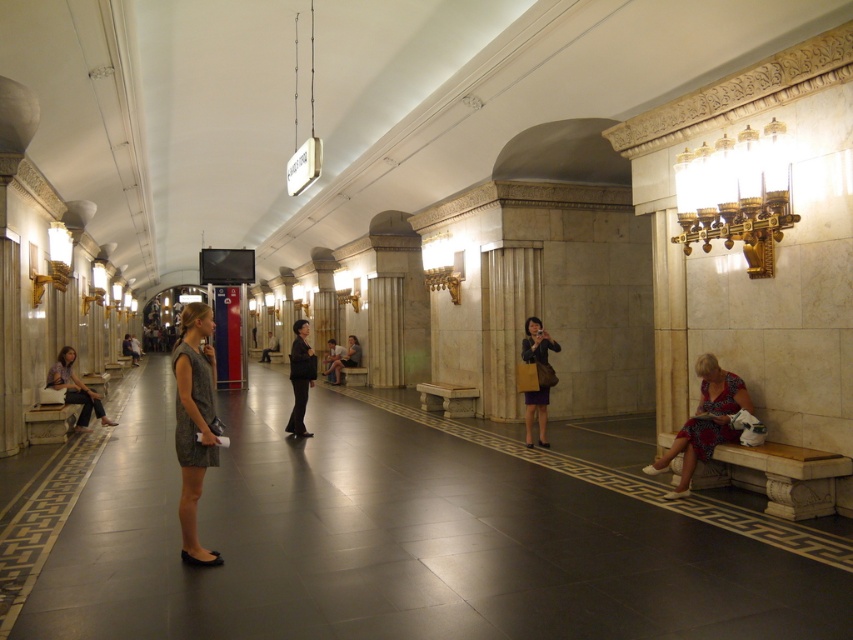
You are a commuter who just arrived at the station and need to sit down. You see a marble bench at lower right and a black leather jacket at center. Which one is shorter in height?

The marble bench at lower right has a lesser height compared to the black leather jacket at center, so the marble bench at lower right is shorter in height.